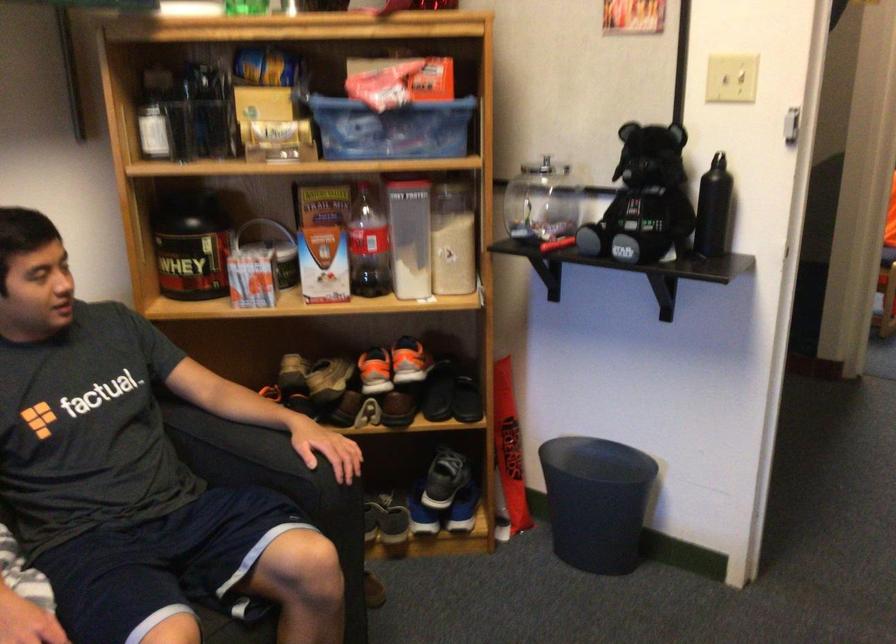
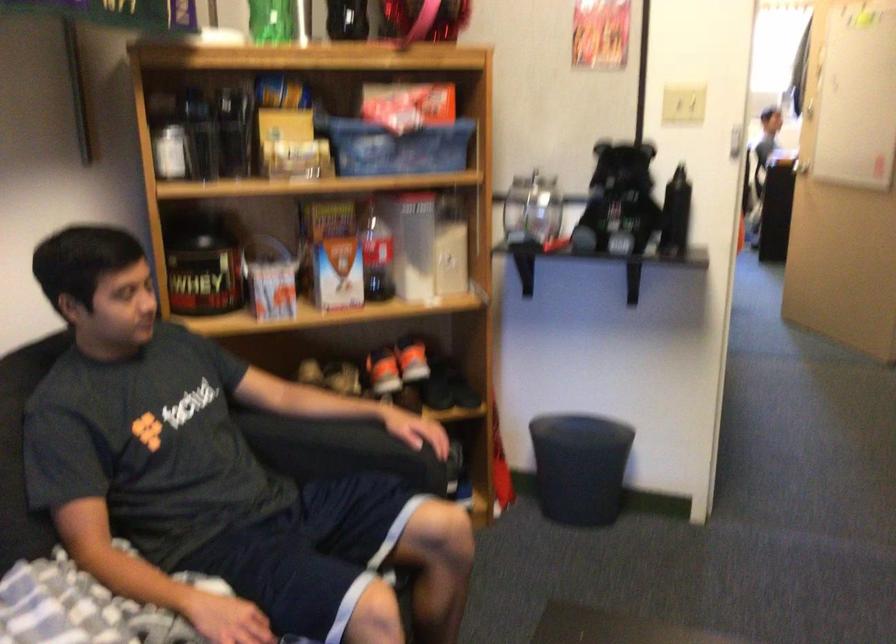
Question: The first image is from the beginning of the video and the second image is from the end. How did the camera likely rotate when shooting the video?

Choices:
 (A) Left
 (B) Right
 (C) Up
 (D) Down

Answer: (B)